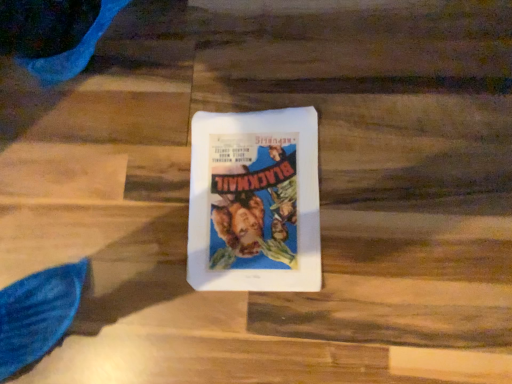
What is the approximate height of white paper book at center?

The height of white paper book at center is 0.62 inches.

You are a GUI agent. You are given a task and a screenshot of the screen. Output one action in this format:
    pyautogui.click(x=<x>, y=<y>)
    Task: Click on the white paper book at center
    Image resolution: width=512 pixels, height=384 pixels.
    Given the screenshot: What is the action you would take?
    pyautogui.click(x=255, y=201)

What do you see at coordinates (255, 201) in the screenshot? I see `white paper book at center` at bounding box center [255, 201].

Identify the location of white paper book at center. (255, 201).